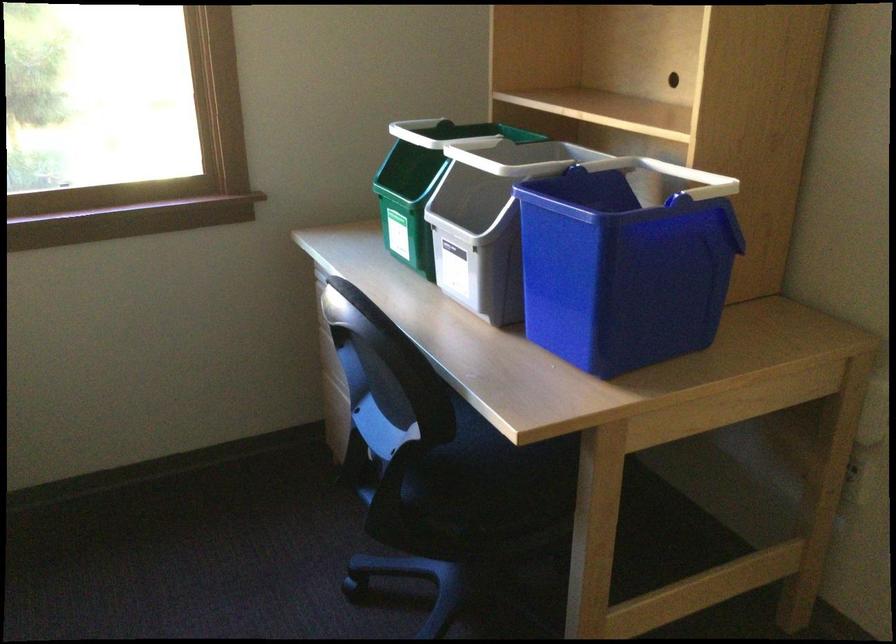
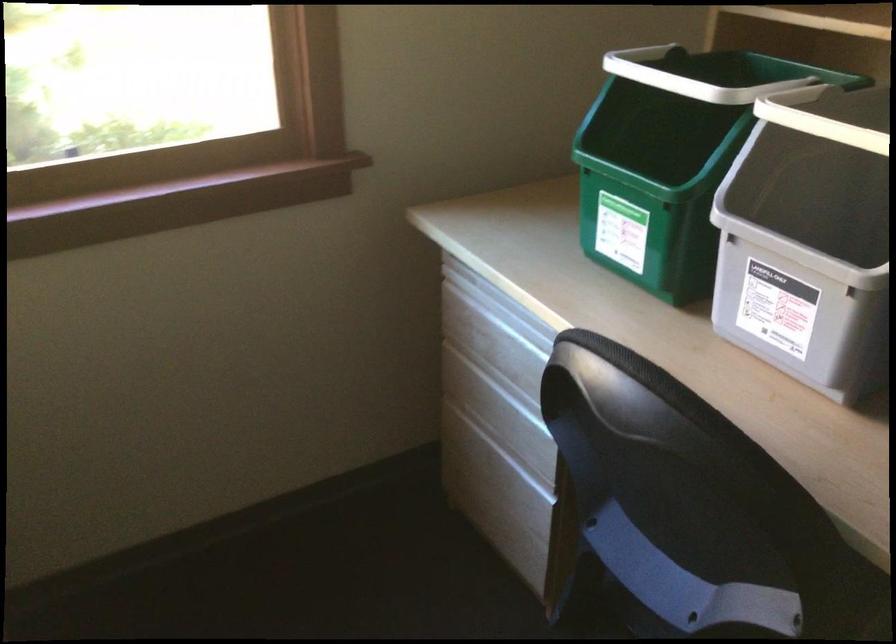
Question: The first image is from the beginning of the video and the second image is from the end. How did the camera likely rotate when shooting the video?

Choices:
 (A) Left
 (B) Right
 (C) Up
 (D) Down

Answer: (D)